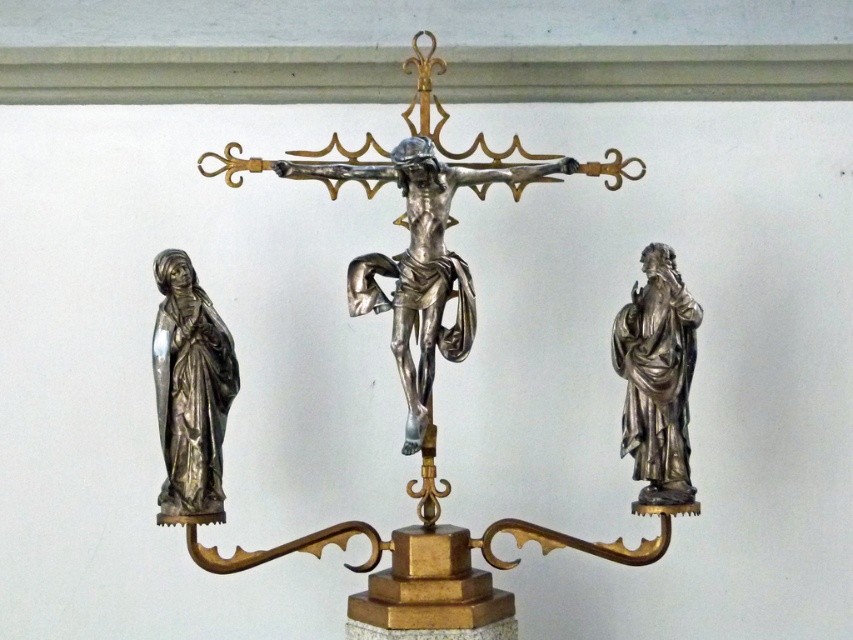
From the picture: You are an art curator examining the religious sculpture. You notice two smaller polished silver statues on either side of the central figure. Which of the two, the polished silver statue at left or the polished silver statue at right, is positioned closer to the central figure?

The polished silver statue at left is positioned closer to the central figure because it is to the left of the polished silver statue at right, which is further away.

You are an art conservator examining the religious sculpture. You need to document the exact position of the polished silver statue at left. What are its coordinates?

The polished silver statue at left is located at coordinates (190, 388).

You are an art conservator examining the religious sculpture. You need to clean both the polished silver statue at left and the polished silver statue at right. Which statue should you clean first if you want to start with the one closer to the viewer?

The polished silver statue at left is closer to the viewer, so you should clean it first.